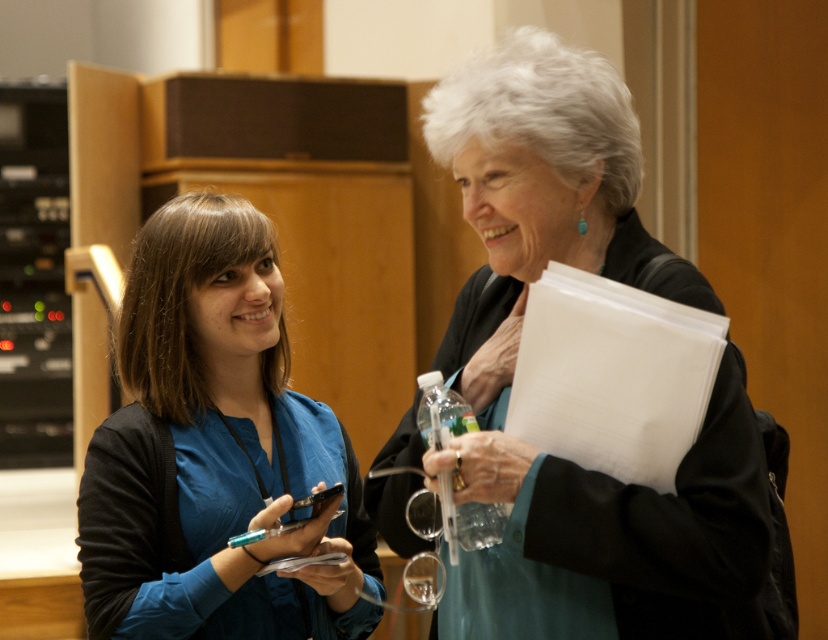
Looking at this image, you are organizing a meeting and need to place a teal fabric jacket at center and a clear plastic bottle at center on a small shelf. Which item should you place first to ensure both fit on the shelf?

Since the teal fabric jacket at center is larger in size than the clear plastic bottle at center, you should place the teal fabric jacket at center first to ensure both items fit on the shelf.

You are organizing a meeting and need to place a 1.2 meter tall standing desk between the teal fabric jacket at center and the clear plastic bottle at center. Can the desk fit vertically between them without exceeding their height?

The teal fabric jacket at center is taller than the clear plastic bottle at center, but the desk is 1.2 meters tall. Since the jacket is taller than the bottle, but the exact height isn not provided, we cannot confirm if the desk can fit vertically between them.

You are a photographer standing in the conference room. You want to take a photo of the blue fabric shirt at center and the clear plastic bottle at center. Which object should you focus on first to ensure both are in focus?

The blue fabric shirt at center is further to the viewer than the clear plastic bottle at center, so you should focus on the blue fabric shirt at center first to ensure both are in focus.